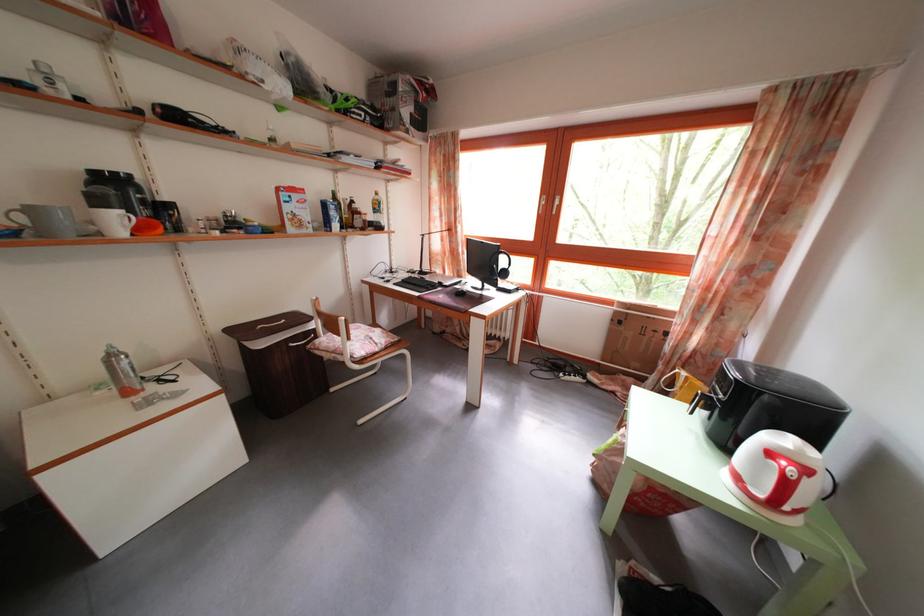
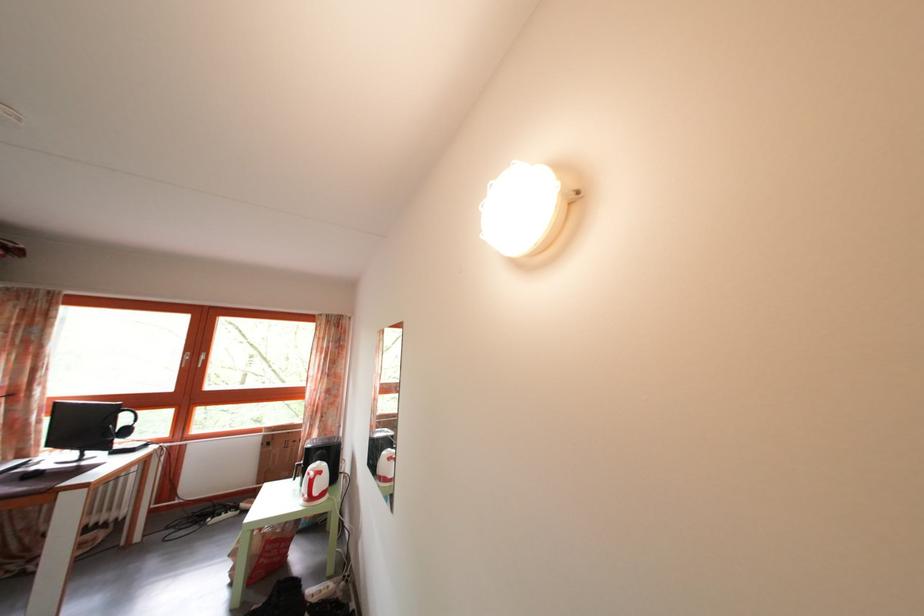
In the second image, find the point that corresponds to point 508,291 in the first image.

(128, 451)